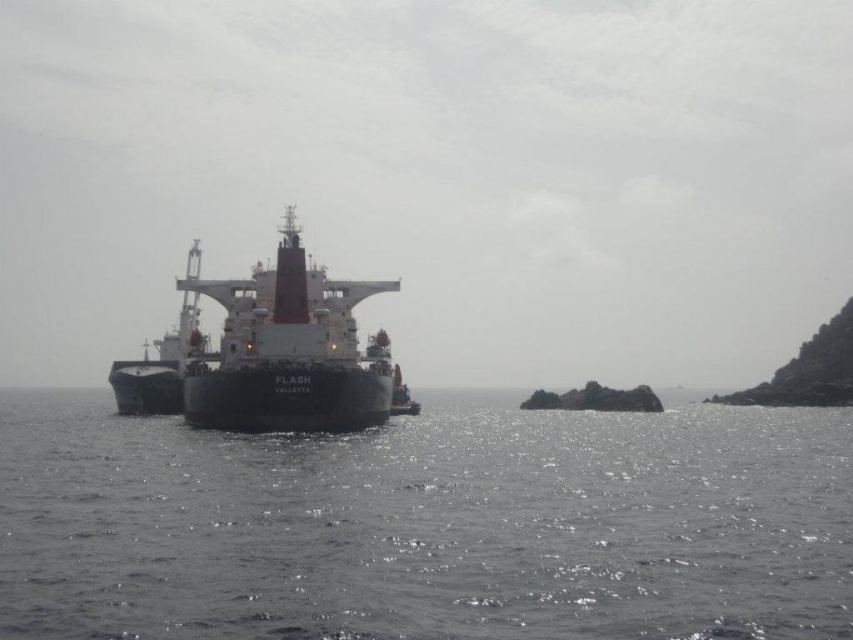
Is point (480, 454) more distant than point (331, 404)?

Yes.

Is point (357, 588) farther from camera compared to point (281, 285)?

No.

Where is `glistening water at center`? Image resolution: width=853 pixels, height=640 pixels. glistening water at center is located at coordinates (427, 524).